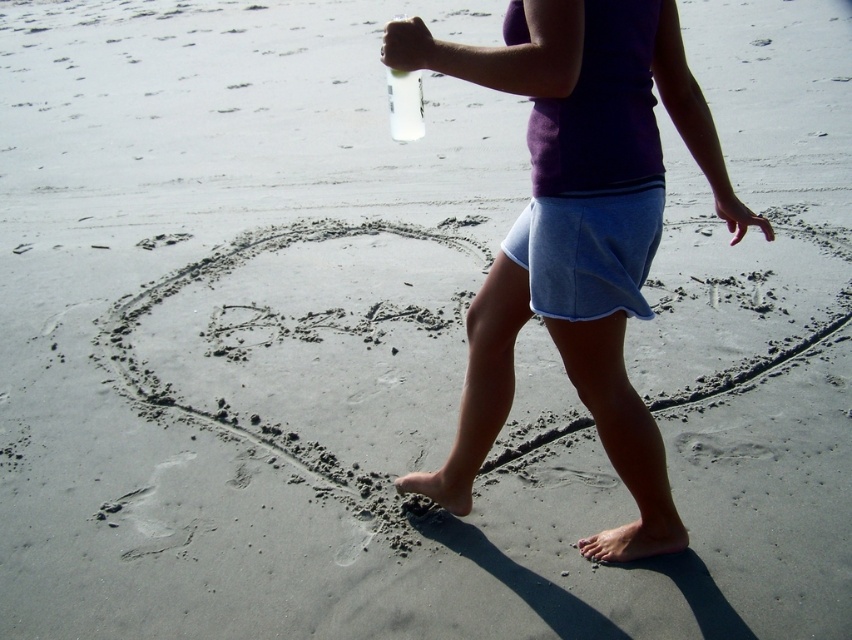
Question: Which object is closer to the camera taking this photo?

Choices:
 (A) clear plastic bottle at upper center
 (B) purple fabric skirt at center

Answer: (B)

Question: Which point is farther from the camera taking this photo?

Choices:
 (A) (620, 413)
 (B) (396, 76)

Answer: (A)

Question: Is purple fabric skirt at center below clear plastic bottle at upper center?

Choices:
 (A) yes
 (B) no

Answer: (A)

Question: Does purple fabric skirt at center have a smaller size compared to clear plastic bottle at upper center?

Choices:
 (A) no
 (B) yes

Answer: (A)

Question: Does purple fabric skirt at center have a greater width compared to clear plastic bottle at upper center?

Choices:
 (A) yes
 (B) no

Answer: (A)